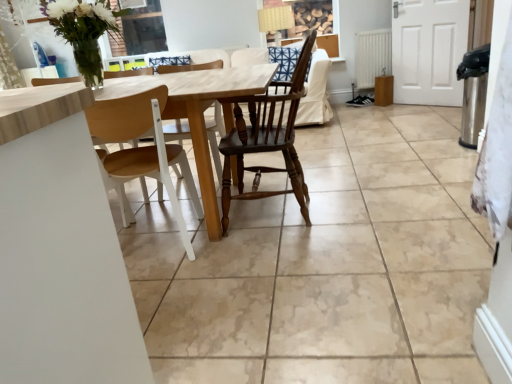
Question: From a real-world perspective, is light wood table at center over wooden at left, placed as the 2th chair when sorted from right to left?

Choices:
 (A) yes
 (B) no

Answer: (B)

Question: From a real-world perspective, is light wood table at center physically below wooden at left, placed as the first chair when sorted from left to right?

Choices:
 (A) yes
 (B) no

Answer: (A)

Question: Is light wood table at center beside wooden at left, placed as the first chair when sorted from left to right?

Choices:
 (A) yes
 (B) no

Answer: (B)

Question: Considering the relative sizes of light wood table at center and wooden at left, placed as the 2th chair when sorted from right to left, in the image provided, is light wood table at center wider than wooden at left, placed as the 2th chair when sorted from right to left,?

Choices:
 (A) yes
 (B) no

Answer: (A)

Question: Is light wood table at center to the right of wooden at left, placed as the 2th chair when sorted from right to left, from the viewer's perspective?

Choices:
 (A) yes
 (B) no

Answer: (B)

Question: Is light wood table at center looking in the opposite direction of wooden at left, placed as the first chair when sorted from left to right?

Choices:
 (A) no
 (B) yes

Answer: (B)

Question: Are white matte radiator at right and wooden at left, placed as the 2th chair when sorted from right to left, far apart?

Choices:
 (A) yes
 (B) no

Answer: (A)

Question: Is white matte radiator at right at the left side of wooden at left, placed as the first chair when sorted from left to right?

Choices:
 (A) yes
 (B) no

Answer: (B)

Question: Is white matte radiator at right closer to camera compared to wooden at left, placed as the 2th chair when sorted from right to left?

Choices:
 (A) no
 (B) yes

Answer: (A)

Question: Is white matte radiator at right to the right of wooden at left, placed as the first chair when sorted from left to right, from the viewer's perspective?

Choices:
 (A) yes
 (B) no

Answer: (A)

Question: Considering the relative sizes of white matte radiator at right and wooden at left, placed as the 2th chair when sorted from right to left, in the image provided, is white matte radiator at right smaller than wooden at left, placed as the 2th chair when sorted from right to left,?

Choices:
 (A) yes
 (B) no

Answer: (A)

Question: Considering the relative sizes of white matte radiator at right and wooden at left, placed as the 2th chair when sorted from right to left, in the image provided, is white matte radiator at right thinner than wooden at left, placed as the 2th chair when sorted from right to left,?

Choices:
 (A) no
 (B) yes

Answer: (B)

Question: From the image's perspective, would you say dark wood chair at center, positioned as the 1th chair in right-to-left order, is positioned over light wood table at center?

Choices:
 (A) yes
 (B) no

Answer: (A)